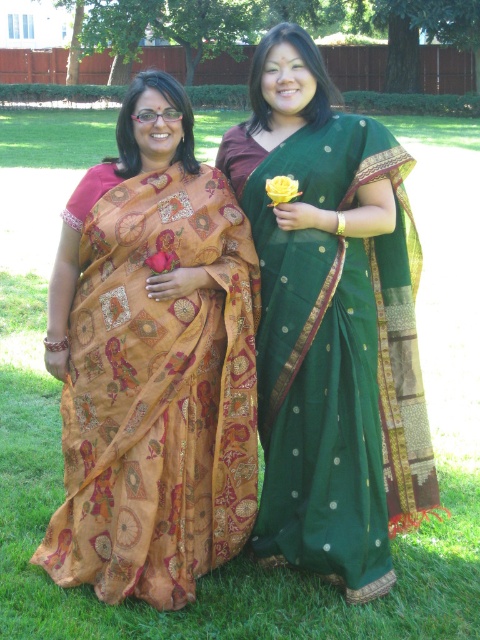
Question: Is matte orange sari at left wider than green silk saree at center?

Choices:
 (A) yes
 (B) no

Answer: (B)

Question: Does matte orange sari at left appear under green silk saree at center?

Choices:
 (A) no
 (B) yes

Answer: (B)

Question: Where is matte orange sari at left located in relation to green silk saree at center in the image?

Choices:
 (A) above
 (B) below

Answer: (B)

Question: Which point is closer to the camera?

Choices:
 (A) green silk saree at center
 (B) matte orange sari at left

Answer: (B)

Question: Which point is closer to the camera?

Choices:
 (A) (292, 529)
 (B) (126, 243)

Answer: (B)